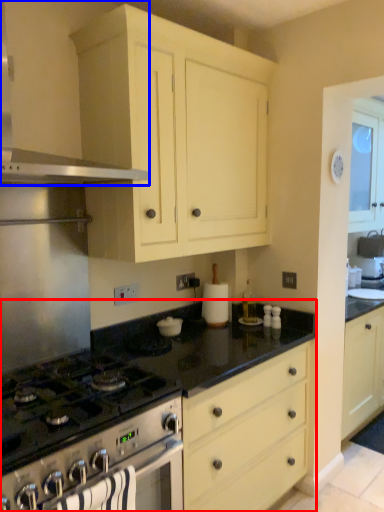
Question: Which of the following is the closest to the observer, countertop (highlighted by a red box) or kitchen appliance (highlighted by a blue box)?

Choices:
 (A) countertop
 (B) kitchen appliance

Answer: (B)